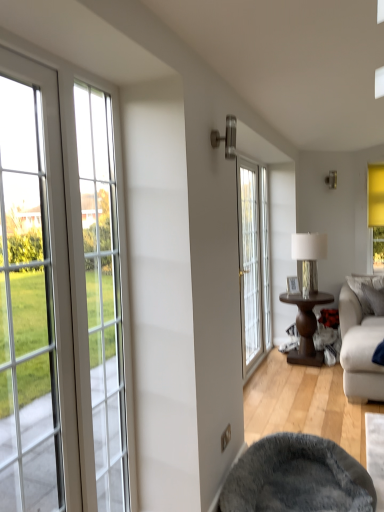
Question: From a real-world perspective, is gray plush bean bag chair at lower center on top of white fabric couch at lower right?

Choices:
 (A) no
 (B) yes

Answer: (A)

Question: Considering the relative sizes of gray plush bean bag chair at lower center and white fabric couch at lower right in the image provided, is gray plush bean bag chair at lower center taller than white fabric couch at lower right?

Choices:
 (A) yes
 (B) no

Answer: (B)

Question: Is gray plush bean bag chair at lower center in front of white fabric couch at lower right?

Choices:
 (A) no
 (B) yes

Answer: (B)

Question: Is gray plush bean bag chair at lower center behind white fabric couch at lower right?

Choices:
 (A) no
 (B) yes

Answer: (A)

Question: Can you confirm if gray plush bean bag chair at lower center is positioned to the right of white fabric couch at lower right?

Choices:
 (A) yes
 (B) no

Answer: (B)

Question: From a real-world perspective, is wooden picture frame at center above or below gray fabric pillow at right?

Choices:
 (A) above
 (B) below

Answer: (A)

Question: Choose the correct answer: Is wooden picture frame at center inside gray fabric pillow at right or outside it?

Choices:
 (A) inside
 (B) outside

Answer: (B)

Question: Is wooden picture frame at center wider or thinner than gray fabric pillow at right?

Choices:
 (A) thin
 (B) wide

Answer: (A)

Question: Relative to gray fabric pillow at right, is wooden picture frame at center in front or behind?

Choices:
 (A) front
 (B) behind

Answer: (A)

Question: From a real-world perspective, is white fabric couch at lower right above or below wooden picture frame at center?

Choices:
 (A) below
 (B) above

Answer: (A)

Question: In the image, is white fabric couch at lower right positioned in front of or behind wooden picture frame at center?

Choices:
 (A) behind
 (B) front

Answer: (B)

Question: Is point (360, 318) positioned closer to the camera than point (294, 278)?

Choices:
 (A) closer
 (B) farther

Answer: (A)

Question: In terms of height, does white fabric couch at lower right look taller or shorter compared to wooden picture frame at center?

Choices:
 (A) tall
 (B) short

Answer: (A)

Question: From a real-world perspective, is metallic silver lamp at center-right above or below white glass door at center?

Choices:
 (A) above
 (B) below

Answer: (B)

Question: Is metallic silver lamp at center-right taller or shorter than white glass door at center?

Choices:
 (A) short
 (B) tall

Answer: (A)